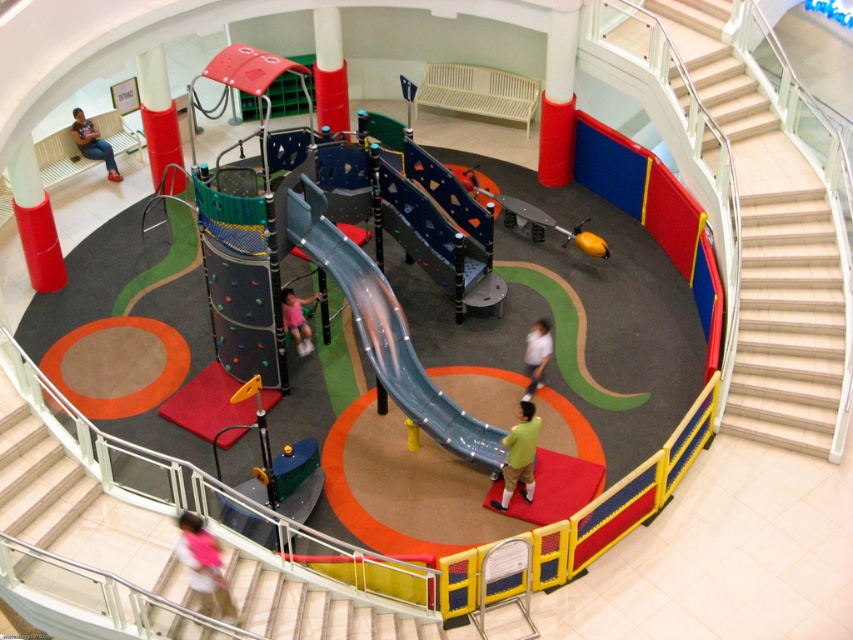
Question: Which object is the farthest from the white glossy stair at lower left?

Choices:
 (A) light blue shirt at center
 (B) smooth blue slide at center
 (C) white tiled stairs at lower right

Answer: (C)

Question: Among these points, which one is farthest from the camera?

Choices:
 (A) (294, 326)
 (B) (300, 582)

Answer: (A)

Question: Does matte pink shirt at upper left have a lesser width compared to light blue shirt at center?

Choices:
 (A) no
 (B) yes

Answer: (A)

Question: Can you confirm if pink fabric shirt at lower left is wider than matte pink shirt at upper left?

Choices:
 (A) yes
 (B) no

Answer: (B)

Question: Estimate the real-world distances between objects in this image. Which object is farther from the green matte shirt at center?

Choices:
 (A) light blue shirt at center
 (B) matte pink shirt at upper left
 (C) white glossy stair at lower left
 (D) white tiled stairs at lower right

Answer: (B)

Question: Does pink fabric shirt at lower left appear on the left side of green matte shirt at center?

Choices:
 (A) no
 (B) yes

Answer: (B)